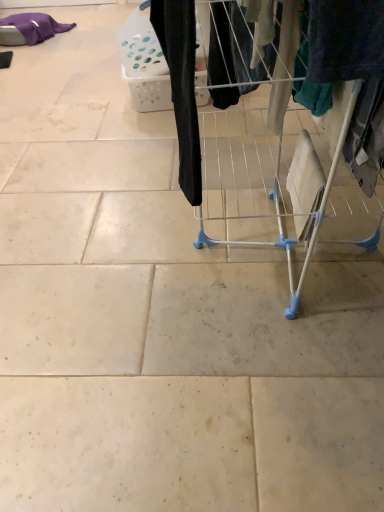
Where is `unoccupied area in front of white wire drying rack at center`? This screenshot has height=512, width=384. unoccupied area in front of white wire drying rack at center is located at coordinates tap(259, 405).